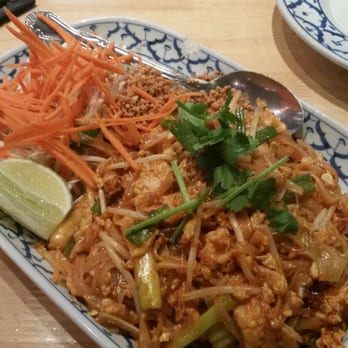
In order to click on metal spoon handle in this screenshot , I will do `click(154, 63)`.